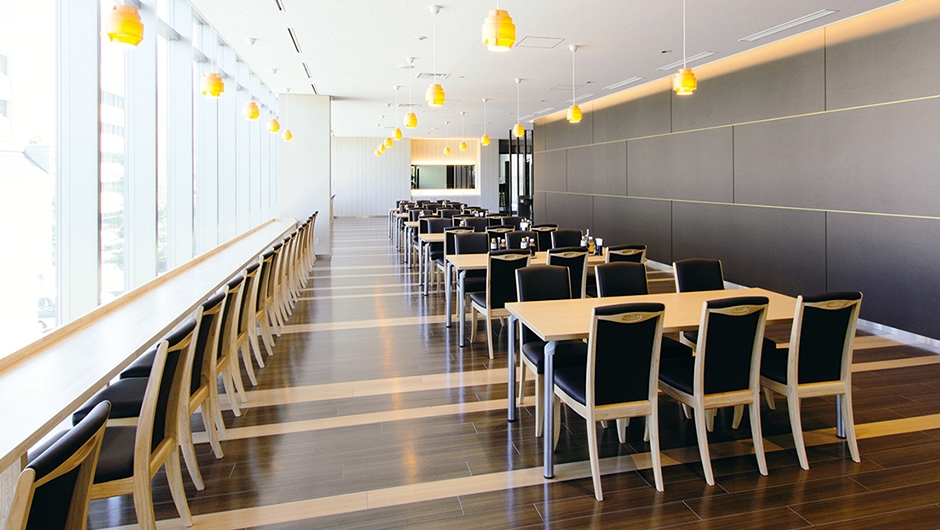
Locate an element on the screen. Image resolution: width=940 pixels, height=530 pixels. windows is located at coordinates (44, 275), (116, 229), (160, 205), (193, 201), (218, 197), (239, 196), (247, 182), (261, 187), (267, 166), (280, 169).